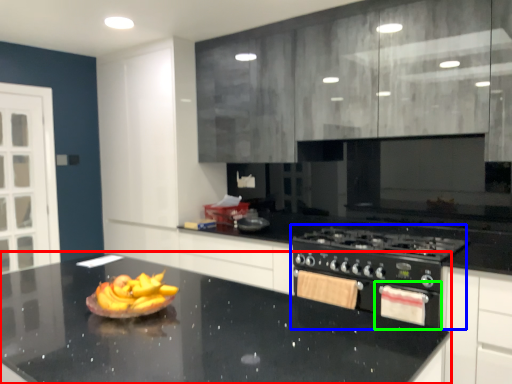
Question: Which is nearer to the countertop (highlighted by a red box)? appliance (highlighted by a blue box) or oven (highlighted by a green box).

Choices:
 (A) appliance
 (B) oven

Answer: (A)